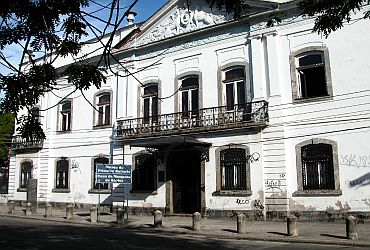
You are a GUI agent. You are given a task and a screenshot of the screen. Output one action in this format:
    pyautogui.click(x=<x>, y=<y>)
    Task: Click on the 7 windows on 2nd floor
    This screenshot has height=250, width=370.
    Given the screenshot: What is the action you would take?
    pyautogui.click(x=321, y=77), pyautogui.click(x=234, y=81), pyautogui.click(x=200, y=97), pyautogui.click(x=146, y=101), pyautogui.click(x=102, y=119), pyautogui.click(x=68, y=108), pyautogui.click(x=23, y=118)